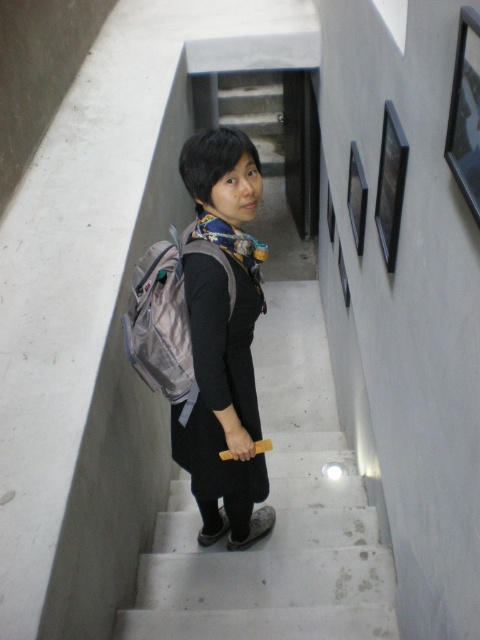
Can you confirm if matte gray stairs at center is thinner than silver fabric backpack at center?

No, matte gray stairs at center is not thinner than silver fabric backpack at center.

Does matte gray stairs at center appear on the left side of silver fabric backpack at center?

No, matte gray stairs at center is not to the left of silver fabric backpack at center.

Between point (267, 420) and point (156, 380), which one is positioned behind?

The point (267, 420) is more distant.

You are a GUI agent. You are given a task and a screenshot of the screen. Output one action in this format:
    pyautogui.click(x=<x>, y=<y>)
    Task: Click on the matte gray stairs at center
    The width and height of the screenshot is (480, 640).
    Given the screenshot: What is the action you would take?
    [x=277, y=516]

Can you confirm if matte gray backpack at center is positioned to the left of silver fabric backpack at center?

In fact, matte gray backpack at center is to the right of silver fabric backpack at center.

Who is more forward, (237, 257) or (173, 355)?

Point (173, 355) is in front.

I want to click on matte gray backpack at center, so click(224, 340).

Does point (172, 540) lie behind point (248, 438)?

Yes, point (172, 540) is behind point (248, 438).

Is point (159, 637) positioned before point (191, 461)?

That is True.

The height and width of the screenshot is (640, 480). I want to click on matte gray stairs at center, so click(x=277, y=516).